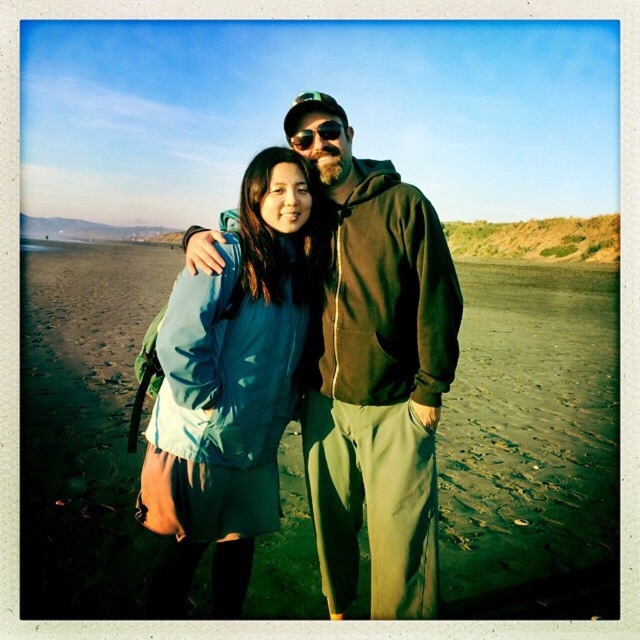
Is point (176, 548) positioned before point (333, 140)?

Yes.

Does teal fabric jacket at center have a larger size compared to sunglasses at center?

Yes, teal fabric jacket at center is bigger than sunglasses at center.

This screenshot has height=640, width=640. What do you see at coordinates (228, 388) in the screenshot?
I see `teal fabric jacket at center` at bounding box center [228, 388].

Identify the location of teal fabric jacket at center. (228, 388).

Is green sand at center further to the viewer compared to green matte jacket at center?

That is True.

Is green sand at center thinner than green matte jacket at center?

No, green sand at center is not thinner than green matte jacket at center.

Between point (134, 476) and point (202, 269), which one is positioned in front?

Point (202, 269)

The height and width of the screenshot is (640, 640). What are the coordinates of `green sand at center` in the screenshot? It's located at (531, 442).

Can you confirm if green sand at center is positioned below sunglasses at center?

No.

What are the coordinates of `green sand at center` in the screenshot? It's located at (531, 442).

What do you see at coordinates (531, 442) in the screenshot? I see `green sand at center` at bounding box center [531, 442].

Where is `green sand at center`? Image resolution: width=640 pixels, height=640 pixels. green sand at center is located at coordinates (531, 442).